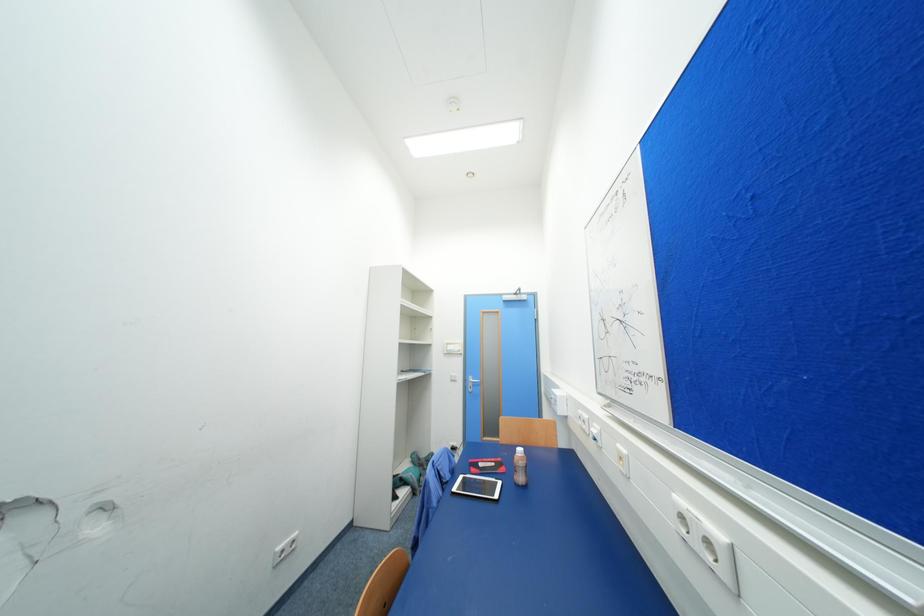
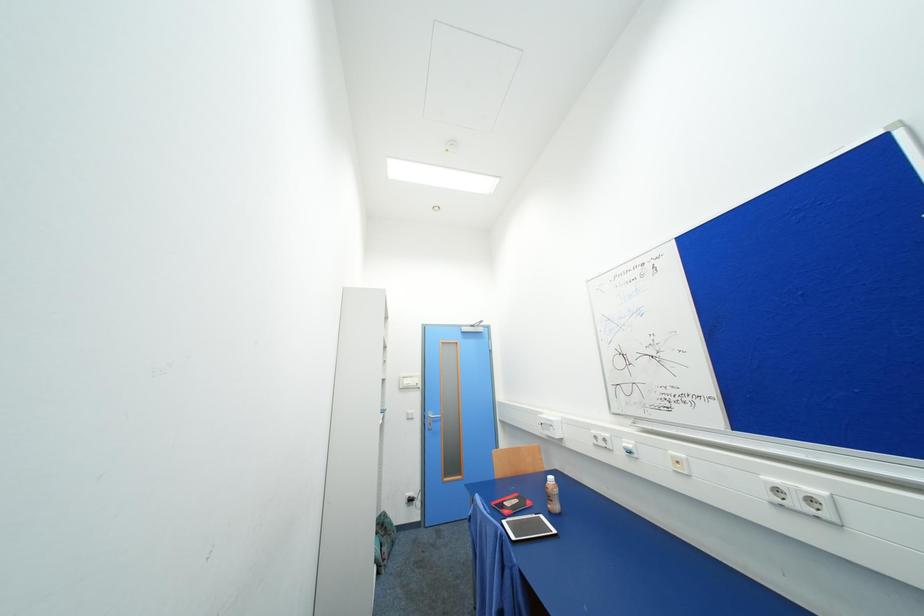
Question: The images are taken continuously from a first-person perspective. In which direction are you moving?

Choices:
 (A) Left
 (B) Right
 (C) Forward
 (D) Backward

Answer: (A)